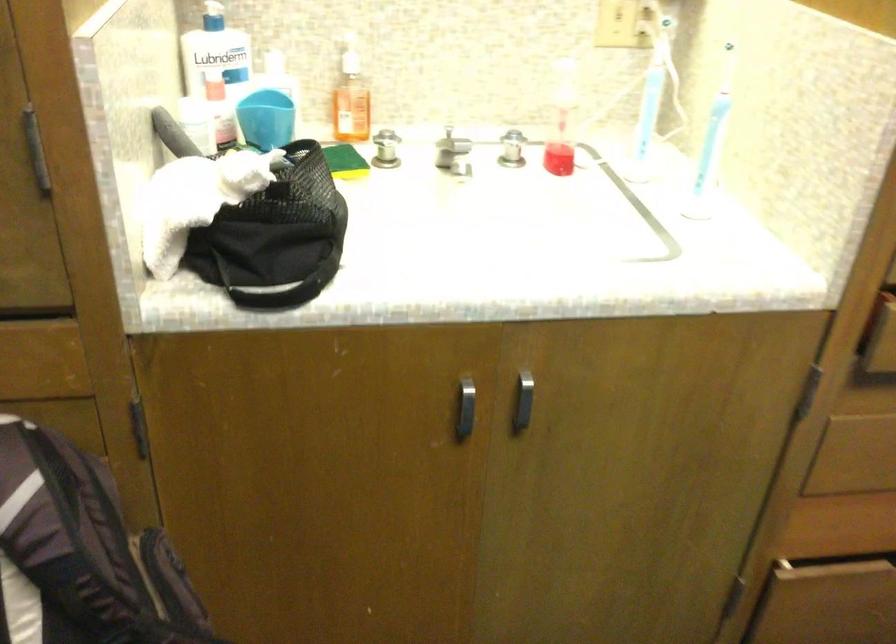
Locate an element on the screen. Image resolution: width=896 pixels, height=644 pixels. white lotion pump is located at coordinates (212, 15).